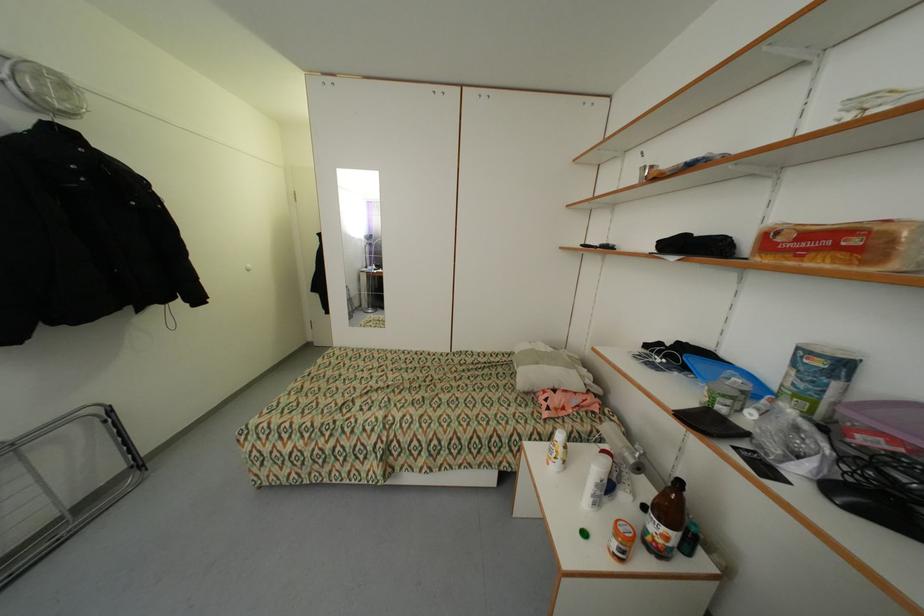
At what (x,y) coordinates should I click in order to perform the action: click on black hairbrush. Please return your answer as a coordinate pair (x, y). Image resolution: width=924 pixels, height=616 pixels. Looking at the image, I should click on (603, 246).